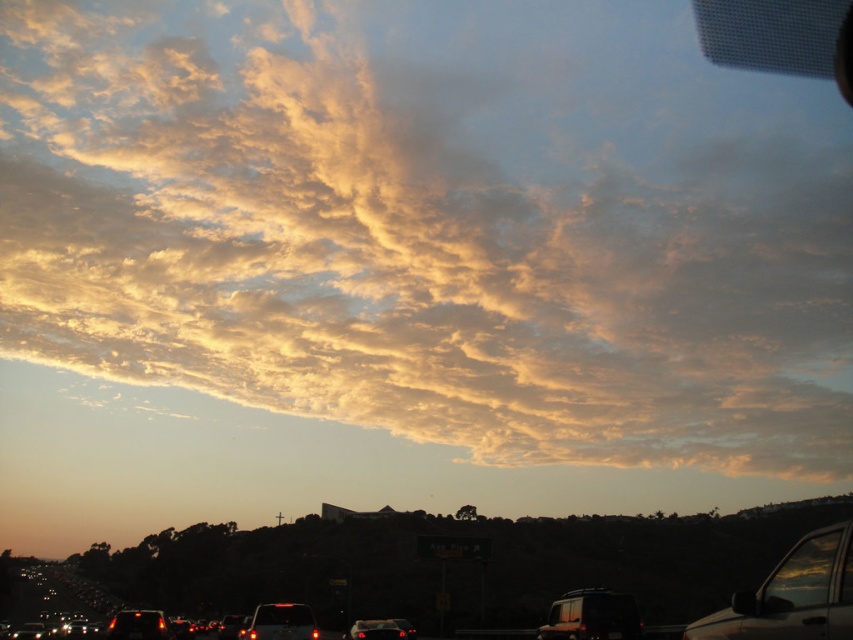
Question: Does transparent glass car window at lower right appear under matte black car at lower left?

Choices:
 (A) no
 (B) yes

Answer: (A)

Question: Is metallic silver car at lower right to the right of matte black car at lower left from the viewer's perspective?

Choices:
 (A) yes
 (B) no

Answer: (A)

Question: Does matte black car at lower left appear on the left side of matte black car at center?

Choices:
 (A) no
 (B) yes

Answer: (B)

Question: Among these points, which one is nearest to the camera?

Choices:
 (A) (357, 636)
 (B) (563, 595)
 (C) (798, 568)
 (D) (154, 634)

Answer: (C)

Question: Which point appears farthest from the camera in this image?

Choices:
 (A) (297, 618)
 (B) (807, 556)

Answer: (A)

Question: Which of the following is the farthest from the observer?

Choices:
 (A) matte black car at center
 (B) transparent glass car window at lower right

Answer: (A)